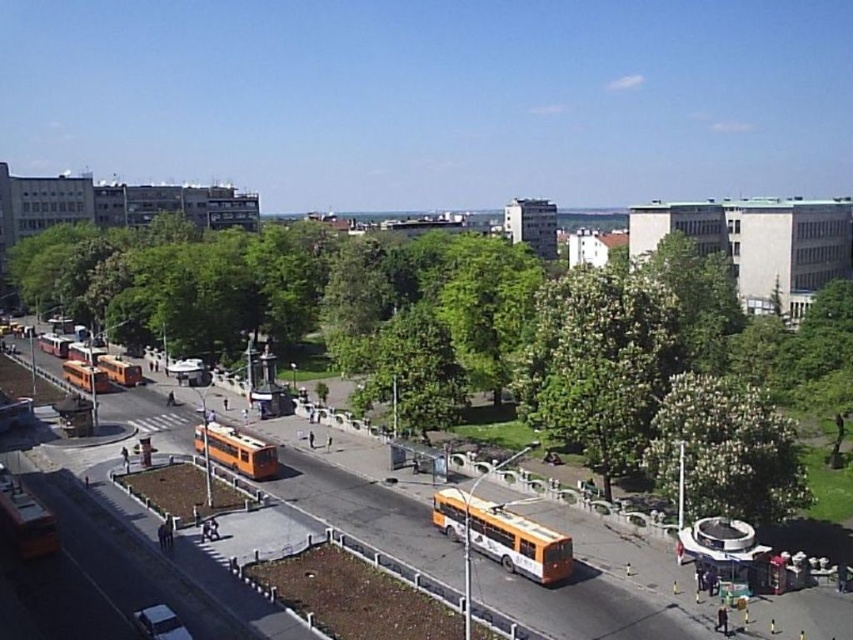
Question: Does green leafy tree at center appear on the left side of orange matte bus at center?

Choices:
 (A) yes
 (B) no

Answer: (B)

Question: Which of the following is the closest to the observer?

Choices:
 (A) orange matte school bus at lower center
 (B) orange matte bus at center
 (C) orange matte school bus at center
 (D) green leafy tree at center

Answer: (A)

Question: Which of the following is the closest to the observer?

Choices:
 (A) orange matte bus at center
 (B) orange matte school bus at center
 (C) orange matte school bus at lower center
 (D) metallic silver car at lower left

Answer: (D)

Question: Is orange matte bus at left to the left of orange matte bus at center-left from the viewer's perspective?

Choices:
 (A) no
 (B) yes

Answer: (A)

Question: Which of the following is the closest to the observer?

Choices:
 (A) orange matte bus at center-left
 (B) orange matte bus at left
 (C) green leafy tree at center
 (D) orange matte bus at center

Answer: (C)

Question: Is orange matte school bus at lower center bigger than orange matte bus at left?

Choices:
 (A) no
 (B) yes

Answer: (B)